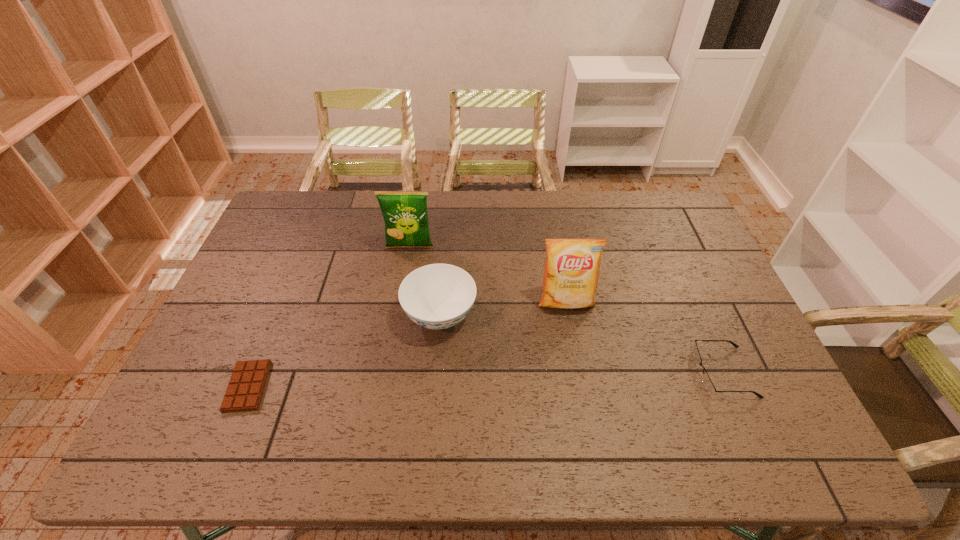
Find the location of `free location at the left edge`. free location at the left edge is located at coordinates (251, 266).

Where is `free space at the right edge`? The image size is (960, 540). free space at the right edge is located at coordinates (752, 418).

Image resolution: width=960 pixels, height=540 pixels. What are the coordinates of `free space at the near right corner` in the screenshot? It's located at (749, 427).

Where is `free spot between the shortest object and the farther crisp (potato chip)`? Image resolution: width=960 pixels, height=540 pixels. free spot between the shortest object and the farther crisp (potato chip) is located at coordinates (328, 317).

Locate an element on the screen. free space between the fourth object from left to right and the chinaware is located at coordinates (503, 309).

At what (x,y) coordinates should I click in order to perform the action: click on vacant area between the nearer crisp (potato chip) and the second shortest object. Please return your answer as a coordinate pair (x, y). Looking at the image, I should click on (644, 338).

Image resolution: width=960 pixels, height=540 pixels. I want to click on free space between the fourth tallest object and the leftmost object, so click(486, 379).

Where is `free spot between the right crisp (potato chip) and the rightmost object`? Image resolution: width=960 pixels, height=540 pixels. free spot between the right crisp (potato chip) and the rightmost object is located at coordinates (644, 338).

This screenshot has height=540, width=960. In order to click on free space between the second shortest object and the farther crisp (potato chip) in this screenshot , I will do `click(566, 309)`.

I want to click on free area in between the second shortest object and the farther crisp (potato chip), so click(x=566, y=309).